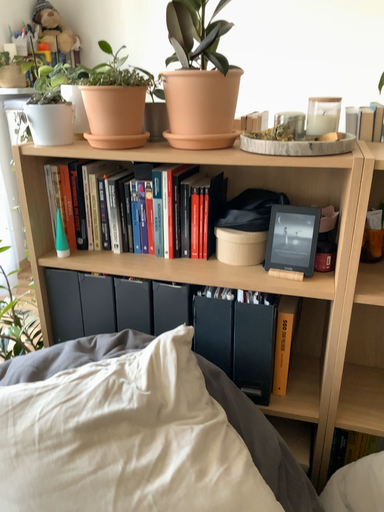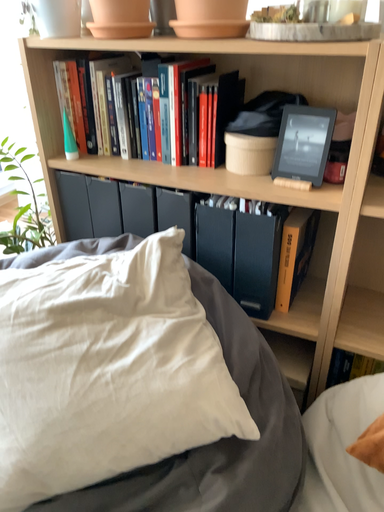
Question: How did the camera likely rotate when shooting the video?

Choices:
 (A) rotated right
 (B) rotated left

Answer: (B)